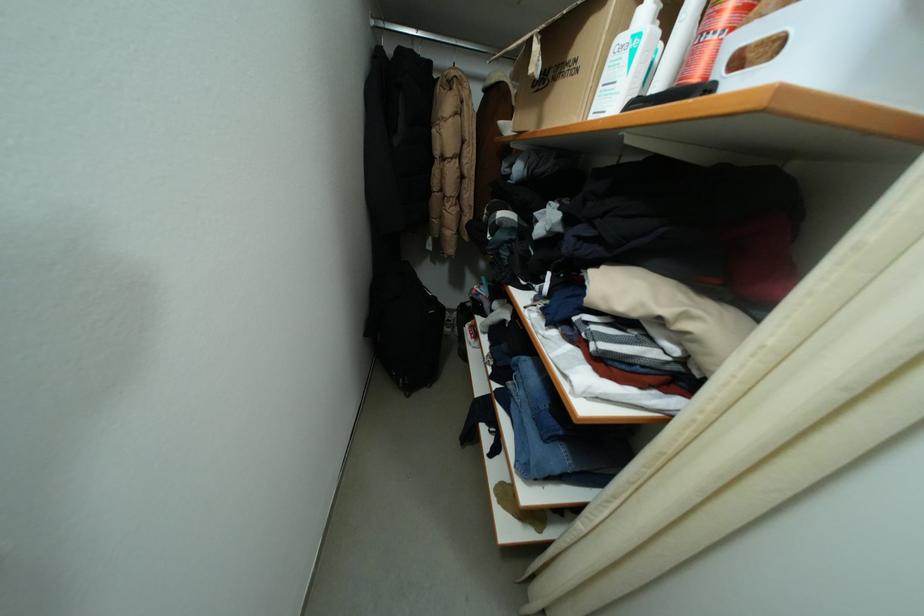
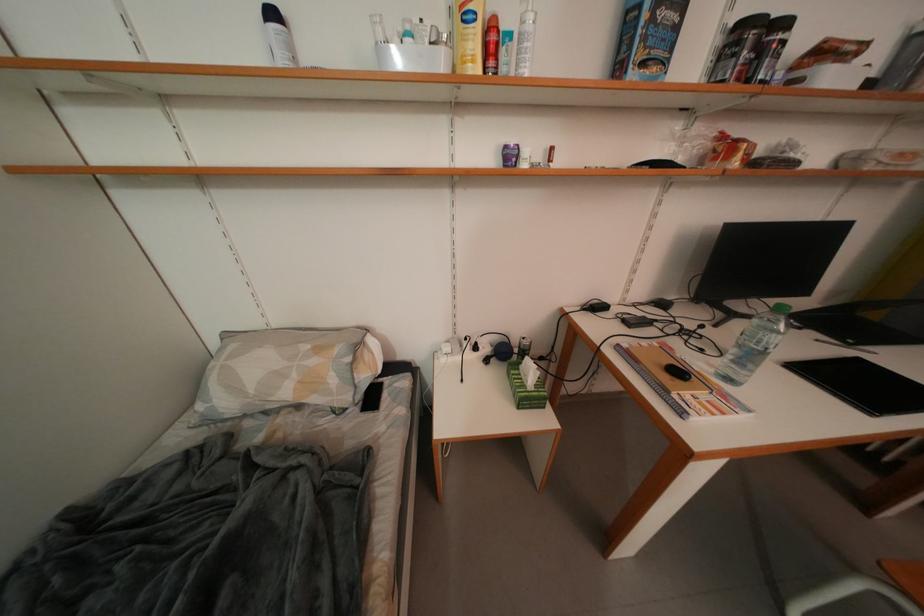
Consider the image. What movement of the cameraman would produce the second image?

The movement direction of the cameraman is right, forward.